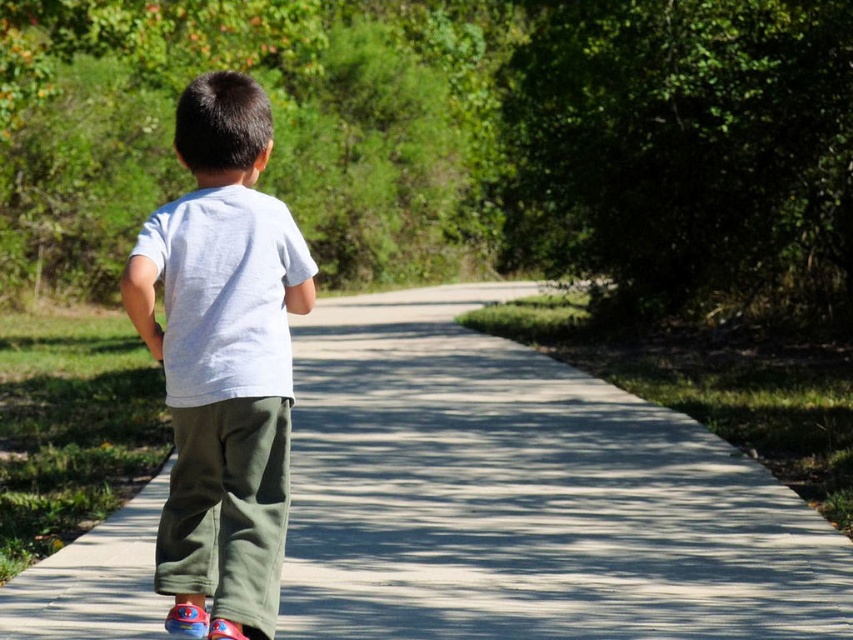
You are a delivery drone flying above the scene. You need to land at the point marked as point (x=525, y=497). According to the scene description, what type of surface will you land on?

The point (x=525, y=497) is on smooth concrete pavement at center, so the drone will land on a smooth concrete surface.

You are a delivery drone flying above the scene. You need to land on the smooth concrete pavement at center. However, you must avoid landing on the white cotton shirt at center. Can you do this? Please explain why or why not.

The smooth concrete pavement at center is located below the white cotton shirt at center, so the drone cannot land on the pavement without first passing under the shirt. Since the shirt is likely worn by the child standing on the pavement, the drone would need to navigate carefully to avoid the shirt and land safely on the pavement below.

You are a delivery robot that needs to navigate through the pathway. The smooth concrete pavement at center is your path. The white cotton shirt at center belongs to the child in front of you. Can you pass through the pathway without touching the child?

The smooth concrete pavement at center is wider than the white cotton shirt at center, so yes, the delivery robot can pass through the pathway without touching the child.